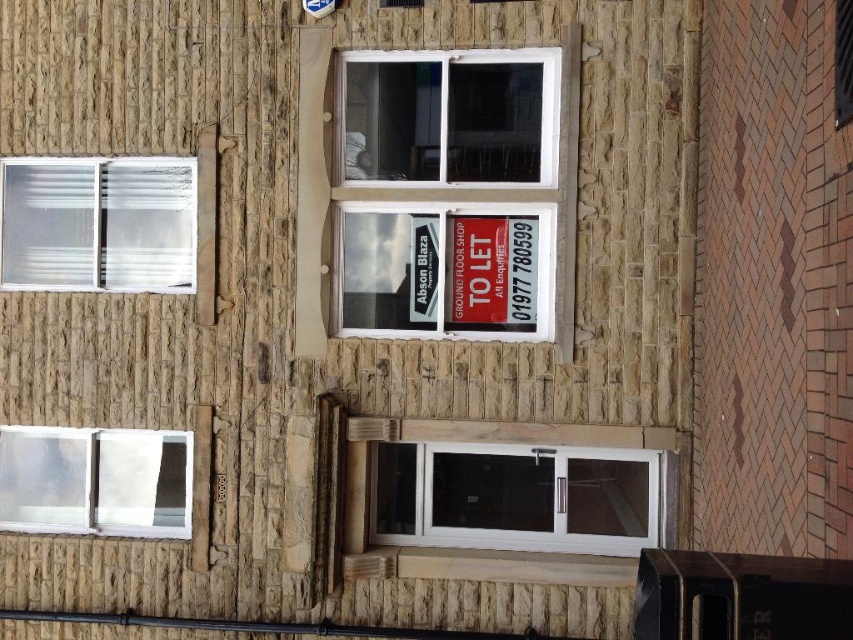
Is white plastic window at center behind transparent plastic window at upper left?

No, it is in front of transparent plastic window at upper left.

This screenshot has height=640, width=853. I want to click on white plastic window at center, so click(x=457, y=176).

Where is `white plastic window at center`? white plastic window at center is located at coordinates (457, 176).

You are a GUI agent. You are given a task and a screenshot of the screen. Output one action in this format:
    pyautogui.click(x=<x>, y=<y>)
    Task: Click on the white plastic window at center
    The width and height of the screenshot is (853, 640).
    Given the screenshot: What is the action you would take?
    pyautogui.click(x=457, y=176)

Does white glass door at lower center appear over transparent plastic window at lower left?

Incorrect, white glass door at lower center is not positioned above transparent plastic window at lower left.

Who is shorter, white glass door at lower center or transparent plastic window at lower left?

transparent plastic window at lower left

This screenshot has height=640, width=853. Describe the element at coordinates (514, 497) in the screenshot. I see `white glass door at lower center` at that location.

You are a GUI agent. You are given a task and a screenshot of the screen. Output one action in this format:
    pyautogui.click(x=<x>, y=<y>)
    Task: Click on the white glass door at lower center
    This screenshot has height=640, width=853.
    Given the screenshot: What is the action you would take?
    pyautogui.click(x=514, y=497)

Does white glass door at lower center have a greater height compared to transparent plastic window at upper left?

Incorrect, white glass door at lower center's height is not larger of transparent plastic window at upper left's.

Measure the distance between white glass door at lower center and camera.

11.90 meters

The height and width of the screenshot is (640, 853). In order to click on white glass door at lower center in this screenshot , I will do `click(514, 497)`.

Image resolution: width=853 pixels, height=640 pixels. I want to click on white glass door at lower center, so click(514, 497).